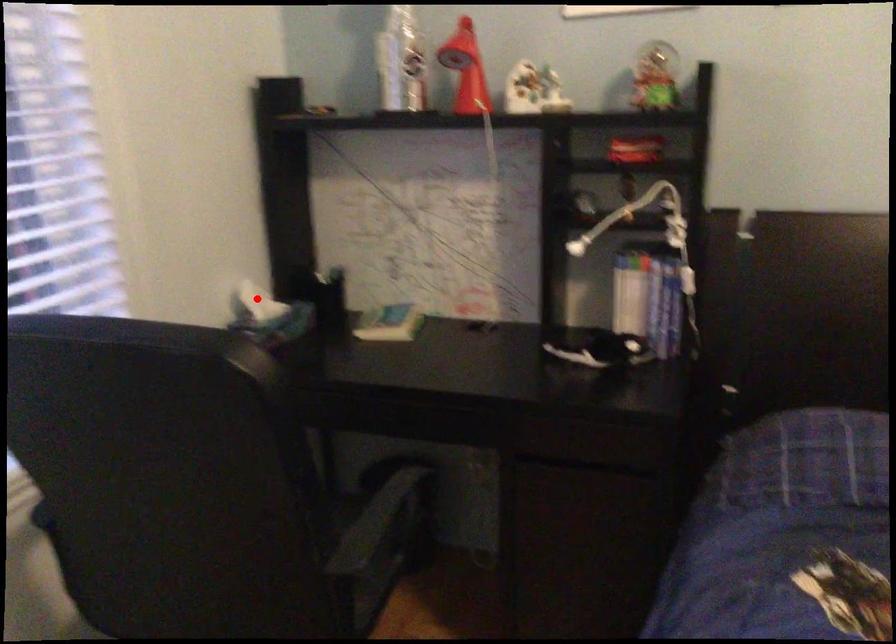
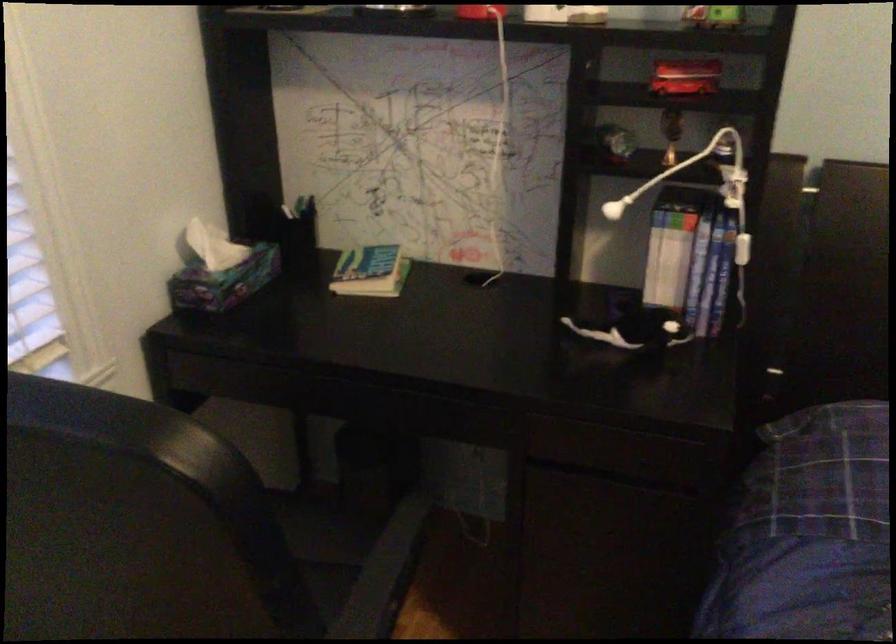
Question: A red point is marked in image1. In image2, is the corresponding 3D point closer to the camera or farther? Reply with the corresponding letter.

Choices:
 (A) The corresponding 3D point is closer.
 (B) The corresponding 3D point is farther.

Answer: (A)